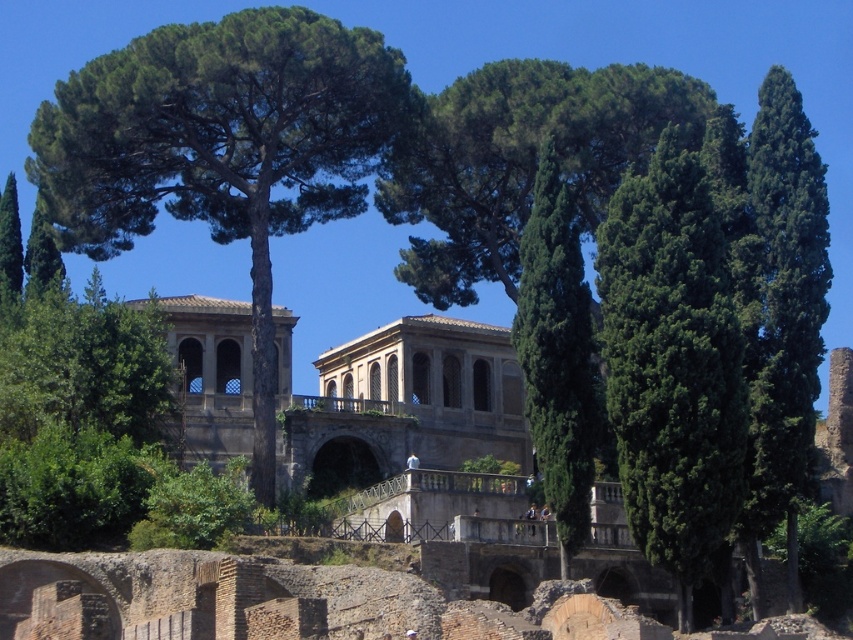
You are standing in front of the historical Roman structure and want to take a photo that includes both the green leafy tree at right and the green textured tree at center. Which tree should you position closer to the camera to ensure both are in the frame?

You should position the green leafy tree at right closer to the camera since it is already closer to the viewer than the green textured tree at center, ensuring both are within the frame.

You are a landscape architect planning to install a walkway between the green textured tree at right and the green textured tree at center. The walkway must be 12 meters long. Can the walkway fit between them?

The distance between the green textured tree at right and the green textured tree at center is 13.65 meters. Since the walkway is 12 meters long, it can fit between them with 1.65 meters of space remaining.